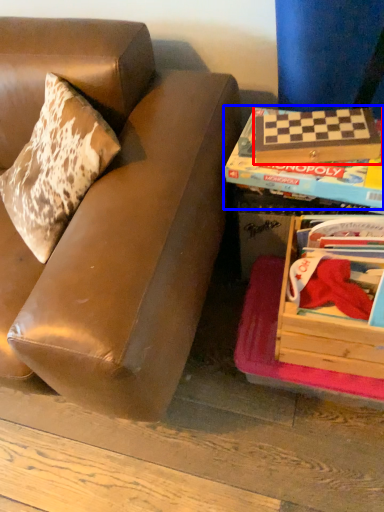
Question: Among these objects, which one is nearest to the camera, paperback book (highlighted by a red box) or paperback book (highlighted by a blue box)?

Choices:
 (A) paperback book
 (B) paperback book

Answer: (B)